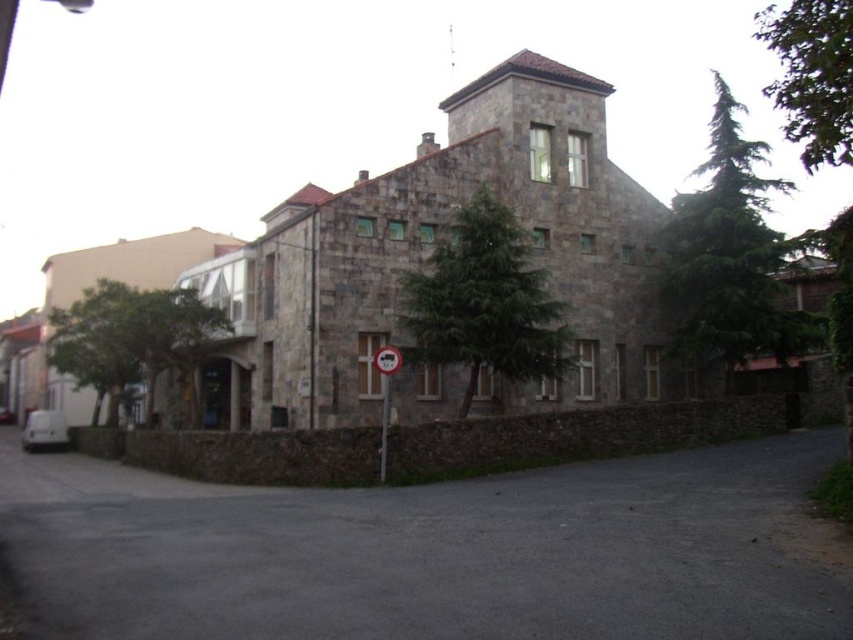
Question: Is green leafy tree at center wider than green leafy tree at upper right?

Choices:
 (A) no
 (B) yes

Answer: (A)

Question: Based on their relative distances, which object is nearer to the green leafy tree at center?

Choices:
 (A) white plastic sign at center
 (B) green needle-like tree at upper right
 (C) white plastic traffic sign at center
 (D) green leafy tree at lower left

Answer: (A)

Question: Which object appears farthest from the camera in this image?

Choices:
 (A) green leafy tree at upper right
 (B) green leafy tree at lower left
 (C) white plastic sign at center
 (D) white plastic traffic sign at center

Answer: (B)

Question: Does white plastic sign at center have a lesser width compared to white plastic traffic sign at center?

Choices:
 (A) no
 (B) yes

Answer: (B)

Question: Where is green leafy tree at upper right located in relation to white plastic traffic sign at center in the image?

Choices:
 (A) right
 (B) left

Answer: (A)

Question: Among these objects, which one is farthest from the camera?

Choices:
 (A) green leafy tree at center
 (B) white plastic sign at center

Answer: (A)